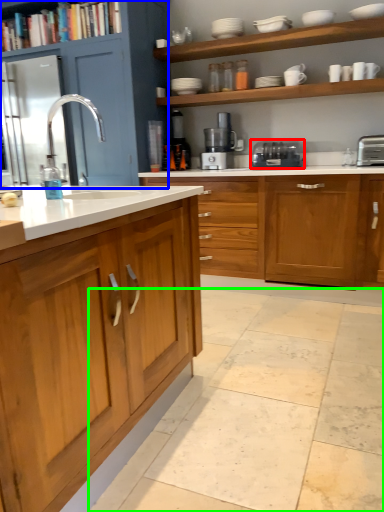
Question: Estimate the real-world distances between objects in this image. Which object is farther from home appliance (highlighted by a red box), cabinetry (highlighted by a blue box) or ceramic tile (highlighted by a green box)?

Choices:
 (A) cabinetry
 (B) ceramic tile

Answer: (B)